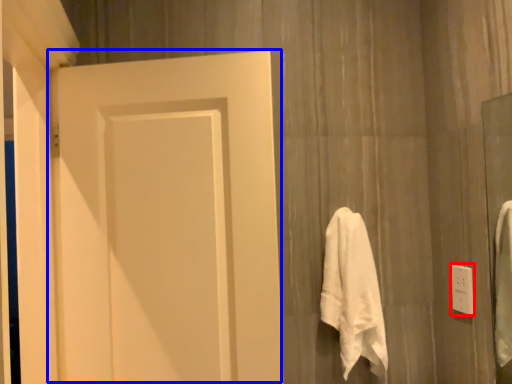
Question: Which of the following is the farthest to the observer, electric outlet (highlighted by a red box) or door (highlighted by a blue box)?

Choices:
 (A) electric outlet
 (B) door

Answer: (A)